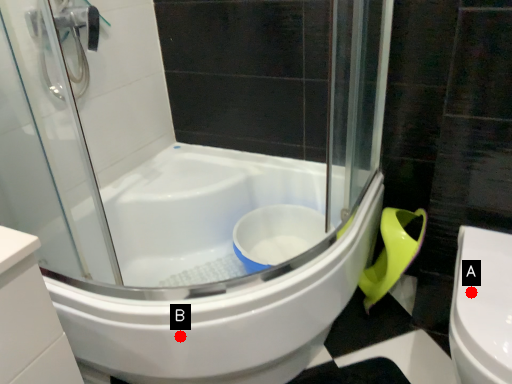
Question: Two points are circled on the image, labeled by A and B beside each circle. Which point is further to the camera?

Choices:
 (A) A is further
 (B) B is further

Answer: (B)